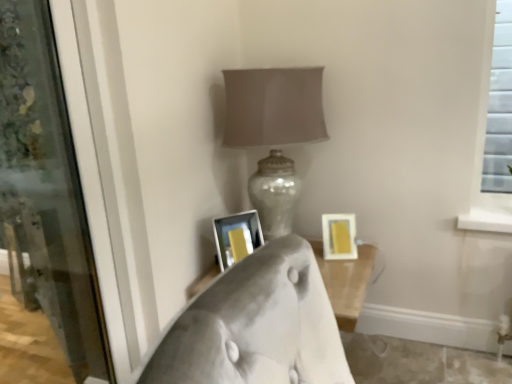
Where is `white glossy picture frame at center, which is the 2th picture frame in right-to-left order`? This screenshot has width=512, height=384. white glossy picture frame at center, which is the 2th picture frame in right-to-left order is located at coordinates (234, 229).

Looking at this image, what is the approximate height of yellow matte picture frame at lower right, arranged as the first picture frame when viewed from the right?

yellow matte picture frame at lower right, arranged as the first picture frame when viewed from the right, is 14.78 centimeters in height.

This screenshot has width=512, height=384. I want to click on yellow matte picture frame at lower right, which appears as the second picture frame when viewed from the left, so click(x=339, y=236).

Identify the location of white glossy picture frame at center, which is the 2th picture frame in right-to-left order. The image size is (512, 384). (234, 229).

Can you confirm if matte silver lamp at center is shorter than yellow matte picture frame at lower right, arranged as the first picture frame when viewed from the right?

No.

Would you consider matte silver lamp at center to be distant from yellow matte picture frame at lower right, which appears as the second picture frame when viewed from the left?

No, matte silver lamp at center is not far away from yellow matte picture frame at lower right, which appears as the second picture frame when viewed from the left.

From a real-world perspective, which object rests below the other?

yellow matte picture frame at lower right, arranged as the first picture frame when viewed from the right, is physically lower.

Which point is more distant from viewer, (289, 80) or (334, 251)?

Positioned behind is point (334, 251).

Can you confirm if transparent glass screen door at left is taller than matte silver lamp at center?

Indeed, transparent glass screen door at left has a greater height compared to matte silver lamp at center.

Which is closer, (80,367) or (314,118)?

The point (314,118) is more forward.

Considering the relative positions of transparent glass screen door at left and matte silver lamp at center in the image provided, is transparent glass screen door at left to the right of matte silver lamp at center from the viewer's perspective?

No, transparent glass screen door at left is not to the right of matte silver lamp at center.

Between transparent glass screen door at left and matte silver lamp at center, which one has larger width?

matte silver lamp at center is wider.

Based on the photo, which object is positioned more to the right, transparent glass screen door at left or yellow matte picture frame at lower right, arranged as the first picture frame when viewed from the right?

Positioned to the right is yellow matte picture frame at lower right, arranged as the first picture frame when viewed from the right.

How many degrees apart are the facing directions of transparent glass screen door at left and yellow matte picture frame at lower right, which appears as the second picture frame when viewed from the left?

The facing directions of transparent glass screen door at left and yellow matte picture frame at lower right, which appears as the second picture frame when viewed from the left, are 88.4 degrees apart.

Is transparent glass screen door at left far from yellow matte picture frame at lower right, which appears as the second picture frame when viewed from the left?

Indeed, transparent glass screen door at left is not near yellow matte picture frame at lower right, which appears as the second picture frame when viewed from the left.

Find the location of a particular element. screen door above the yellow matte picture frame at lower right, arranged as the first picture frame when viewed from the right (from a real-world perspective) is located at coordinates (46, 192).

Looking at this image, which is behind, yellow matte picture frame at lower right, which appears as the second picture frame when viewed from the left, or transparent glass screen door at left?

yellow matte picture frame at lower right, which appears as the second picture frame when viewed from the left, is behind.

Is transparent glass screen door at left at the back of yellow matte picture frame at lower right, arranged as the first picture frame when viewed from the right?

yellow matte picture frame at lower right, arranged as the first picture frame when viewed from the right, does not have its back to transparent glass screen door at left.

From the image's perspective, is yellow matte picture frame at lower right, arranged as the first picture frame when viewed from the right, positioned above or below transparent glass screen door at left?

yellow matte picture frame at lower right, arranged as the first picture frame when viewed from the right, is situated lower than transparent glass screen door at left in the image.

The height and width of the screenshot is (384, 512). Find the location of `screen door that is in front of the yellow matte picture frame at lower right, which appears as the second picture frame when viewed from the left`. screen door that is in front of the yellow matte picture frame at lower right, which appears as the second picture frame when viewed from the left is located at coordinates (46, 192).

Looking at this image, from the image's perspective, is white glossy picture frame at center, which is the 2th picture frame in right-to-left order, on top of yellow matte picture frame at lower right, arranged as the first picture frame when viewed from the right?

Indeed, from the image's perspective, white glossy picture frame at center, which is the 2th picture frame in right-to-left order, is shown above yellow matte picture frame at lower right, arranged as the first picture frame when viewed from the right.

Does white glossy picture frame at center, which is the 2th picture frame in right-to-left order, appear on the right side of yellow matte picture frame at lower right, arranged as the first picture frame when viewed from the right?

No, white glossy picture frame at center, which is the 2th picture frame in right-to-left order, is not to the right of yellow matte picture frame at lower right, arranged as the first picture frame when viewed from the right.

Is white glossy picture frame at center, the first picture frame from the left, positioned with its back to yellow matte picture frame at lower right, arranged as the first picture frame when viewed from the right?

No, white glossy picture frame at center, the first picture frame from the left, is not facing away from yellow matte picture frame at lower right, arranged as the first picture frame when viewed from the right.

Does white glossy picture frame at center, the first picture frame from the left, have a lesser width compared to yellow matte picture frame at lower right, which appears as the second picture frame when viewed from the left?

No, white glossy picture frame at center, the first picture frame from the left, is not thinner than yellow matte picture frame at lower right, which appears as the second picture frame when viewed from the left.

From the image's perspective, between yellow matte picture frame at lower right, arranged as the first picture frame when viewed from the right, and matte silver lamp at center, which one is located above?

matte silver lamp at center, from the image's perspective.

The width and height of the screenshot is (512, 384). Find the location of `the 2nd picture frame below the matte silver lamp at center (from a real-world perspective)`. the 2nd picture frame below the matte silver lamp at center (from a real-world perspective) is located at coordinates (339, 236).

Considering the sizes of objects yellow matte picture frame at lower right, which appears as the second picture frame when viewed from the left, and white glossy picture frame at center, which is the 2th picture frame in right-to-left order, in the image provided, who is wider, yellow matte picture frame at lower right, which appears as the second picture frame when viewed from the left, or white glossy picture frame at center, which is the 2th picture frame in right-to-left order,?

With larger width is white glossy picture frame at center, which is the 2th picture frame in right-to-left order.

From the image's perspective, is yellow matte picture frame at lower right, which appears as the second picture frame when viewed from the left, above or below white glossy picture frame at center, which is the 2th picture frame in right-to-left order?

Based on their image positions, yellow matte picture frame at lower right, which appears as the second picture frame when viewed from the left, is located beneath white glossy picture frame at center, which is the 2th picture frame in right-to-left order.

Could white glossy picture frame at center, the first picture frame from the left, be considered to be inside yellow matte picture frame at lower right, which appears as the second picture frame when viewed from the left?

Definitely not — white glossy picture frame at center, the first picture frame from the left, is not inside yellow matte picture frame at lower right, which appears as the second picture frame when viewed from the left.

Considering the relative sizes of yellow matte picture frame at lower right, arranged as the first picture frame when viewed from the right, and white glossy picture frame at center, which is the 2th picture frame in right-to-left order, in the image provided, is yellow matte picture frame at lower right, arranged as the first picture frame when viewed from the right, smaller than white glossy picture frame at center, which is the 2th picture frame in right-to-left order,?

Indeed, yellow matte picture frame at lower right, arranged as the first picture frame when viewed from the right, has a smaller size compared to white glossy picture frame at center, which is the 2th picture frame in right-to-left order.

I want to click on lamp lying above the yellow matte picture frame at lower right, which appears as the second picture frame when viewed from the left (from the image's perspective), so click(274, 107).

You are a GUI agent. You are given a task and a screenshot of the screen. Output one action in this format:
    pyautogui.click(x=<x>, y=<y>)
    Task: Click on the screen door on the left of matte silver lamp at center
    
    Given the screenshot: What is the action you would take?
    pyautogui.click(x=46, y=192)

Based on their spatial positions, is matte silver lamp at center or yellow matte picture frame at lower right, which appears as the second picture frame when viewed from the left, further from white glossy picture frame at center, the first picture frame from the left?

yellow matte picture frame at lower right, which appears as the second picture frame when viewed from the left, lies further to white glossy picture frame at center, the first picture frame from the left, than the other object.

From the image, which object appears to be nearer to matte silver lamp at center, white glossy picture frame at center, the first picture frame from the left, or yellow matte picture frame at lower right, arranged as the first picture frame when viewed from the right?

white glossy picture frame at center, the first picture frame from the left, lies closer to matte silver lamp at center than the other object.

Which object lies further to the anchor point transparent glass screen door at left, white glossy picture frame at center, the first picture frame from the left, or matte silver lamp at center?

white glossy picture frame at center, the first picture frame from the left, is positioned further to the anchor transparent glass screen door at left.

Based on their spatial positions, is matte silver lamp at center or white glossy picture frame at center, the first picture frame from the left, further from transparent glass screen door at left?

The object further to transparent glass screen door at left is white glossy picture frame at center, the first picture frame from the left.

Consider the image. Estimate the real-world distances between objects in this image. Which object is further from matte silver lamp at center, white glossy picture frame at center, which is the 2th picture frame in right-to-left order, or transparent glass screen door at left?

The object further to matte silver lamp at center is transparent glass screen door at left.

When comparing their distances from yellow matte picture frame at lower right, arranged as the first picture frame when viewed from the right, does matte silver lamp at center or white glossy picture frame at center, which is the 2th picture frame in right-to-left order, seem closer?

white glossy picture frame at center, which is the 2th picture frame in right-to-left order.

Estimate the real-world distances between objects in this image. Which object is closer to white glossy picture frame at center, which is the 2th picture frame in right-to-left order, yellow matte picture frame at lower right, which appears as the second picture frame when viewed from the left, or matte silver lamp at center?

Based on the image, matte silver lamp at center appears to be nearer to white glossy picture frame at center, which is the 2th picture frame in right-to-left order.

Estimate the real-world distances between objects in this image. Which object is closer to white glossy picture frame at center, which is the 2th picture frame in right-to-left order, yellow matte picture frame at lower right, arranged as the first picture frame when viewed from the right, or transparent glass screen door at left?

Based on the image, yellow matte picture frame at lower right, arranged as the first picture frame when viewed from the right, appears to be nearer to white glossy picture frame at center, which is the 2th picture frame in right-to-left order.

The height and width of the screenshot is (384, 512). Find the location of `lamp positioned between transparent glass screen door at left and white glossy picture frame at center, the first picture frame from the left, from near to far`. lamp positioned between transparent glass screen door at left and white glossy picture frame at center, the first picture frame from the left, from near to far is located at coordinates (274, 107).

Identify the location of lamp between transparent glass screen door at left and yellow matte picture frame at lower right, arranged as the first picture frame when viewed from the right, along the z-axis. The width and height of the screenshot is (512, 384). (274, 107).

In order to click on lamp between white glossy picture frame at center, the first picture frame from the left, and yellow matte picture frame at lower right, which appears as the second picture frame when viewed from the left in this screenshot , I will do `click(274, 107)`.

This screenshot has height=384, width=512. What are the coordinates of `picture frame between transparent glass screen door at left and yellow matte picture frame at lower right, arranged as the first picture frame when viewed from the right, from front to back` in the screenshot? It's located at (234, 229).